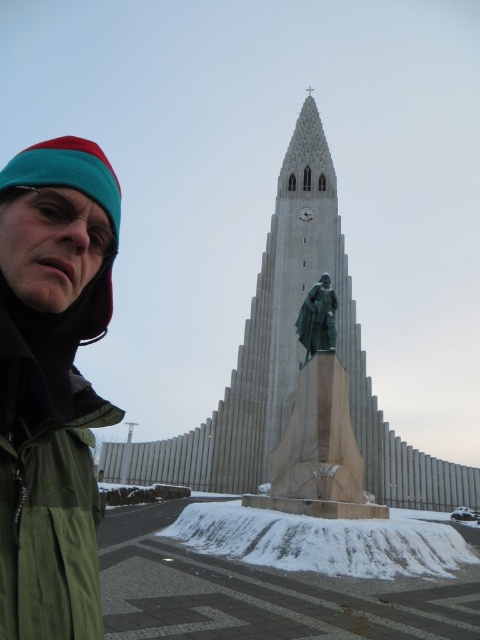
You are a photographer trying to capture the entire modernist church with the statue in the background. However, the green matte jacket at lower left is blocking part of the view. Where should you move to avoid the jacket while still keeping the statue in frame?

Since the green matte jacket at lower left is located at point (48,476), you should move to the right or upwards to avoid it while still keeping the statue in frame.

You are a photographer trying to capture the modernist church in the background. You notice a point at coordinates (48,476) on your camera screen. What object is located at this point?

The point at coordinates (48,476) corresponds to the green matte jacket at lower left.